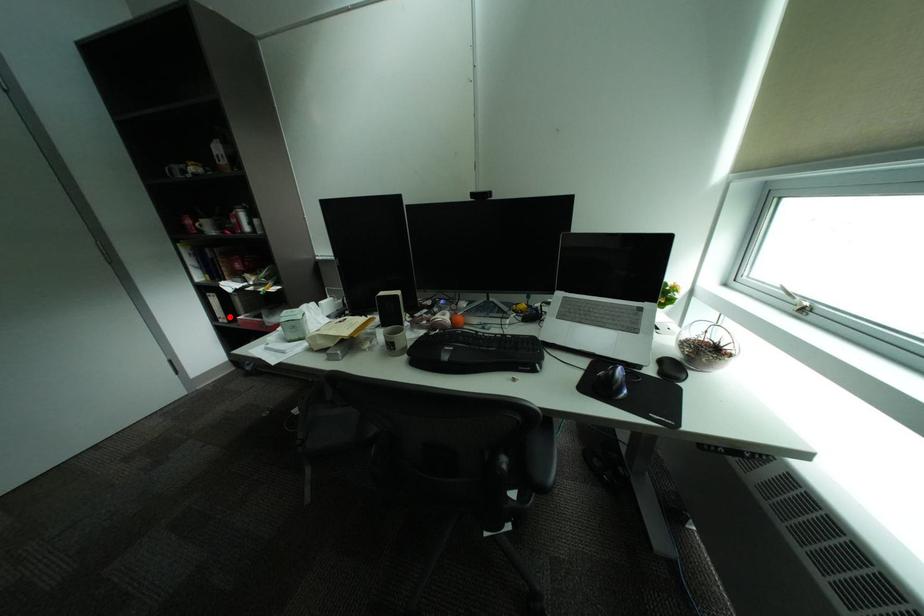
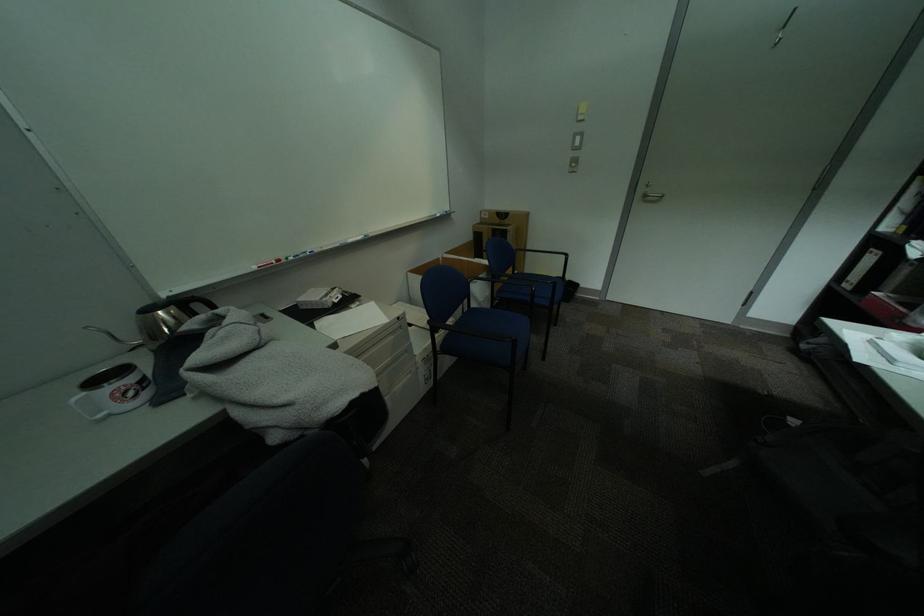
Question: A red point is marked in image1. In image2, is the corresponding 3D point closer to the camera or farther? Reply with the corresponding letter.

Choices:
 (A) The corresponding 3D point is closer.
 (B) The corresponding 3D point is farther.

Answer: (B)